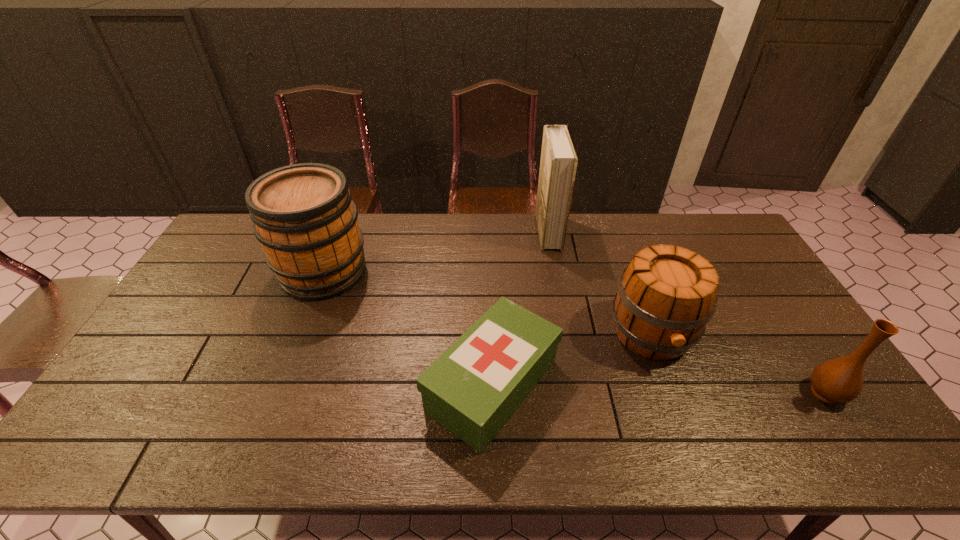
Where is `the third object from left to right`? The height and width of the screenshot is (540, 960). the third object from left to right is located at coordinates (558, 164).

Locate an element on the screen. the leftmost object is located at coordinates click(303, 215).

You are a GUI agent. You are given a task and a screenshot of the screen. Output one action in this format:
    pyautogui.click(x=<x>, y=<y>)
    Task: Click on the left cider
    
    Given the screenshot: What is the action you would take?
    pyautogui.click(x=303, y=215)

Identify the location of vase. Image resolution: width=960 pixels, height=540 pixels. (840, 380).

Find the location of a particular element. the right cider is located at coordinates (666, 295).

Where is `the shorter cider`? This screenshot has height=540, width=960. the shorter cider is located at coordinates (666, 295).

At what (x,y) coordinates should I click in order to perform the action: click on the shortest object. Please return your answer as a coordinate pair (x, y). Image resolution: width=960 pixels, height=540 pixels. Looking at the image, I should click on (473, 388).

The width and height of the screenshot is (960, 540). I want to click on the first-aid kit, so click(473, 388).

Locate an element on the screen. vacant area located 0.320m on the cover of the phonebook is located at coordinates (450, 232).

Locate an element on the screen. This screenshot has width=960, height=540. vacant point located 0.250m on the cover of the phonebook is located at coordinates (469, 232).